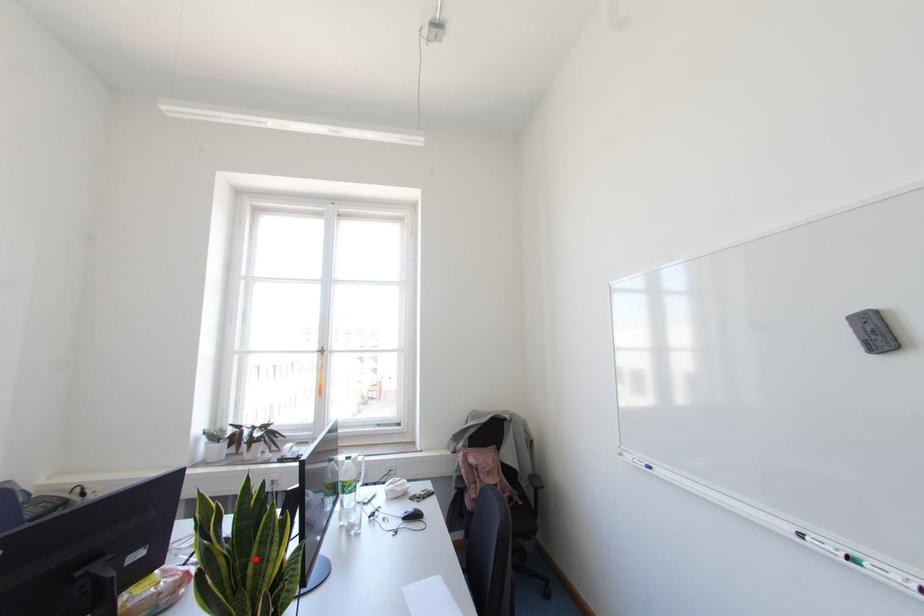
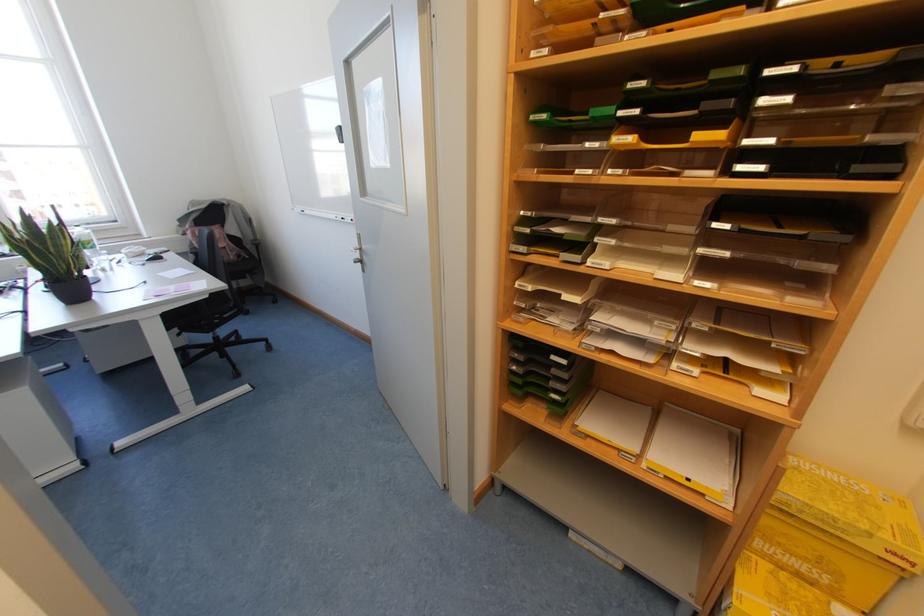
Where in the second image is the point corresponding to the highlighted location from the first image?

(53, 245)